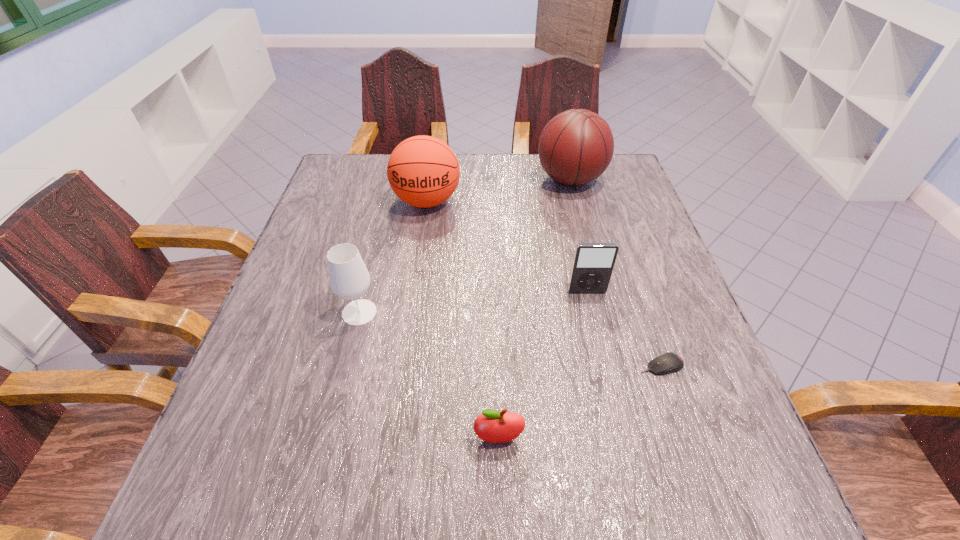
At what (x,y) coordinates should I click in order to perform the action: click on vacant space at the near edge. Please return your answer as a coordinate pair (x, y). The image size is (960, 540). Looking at the image, I should click on (591, 487).

Find the location of a particular element. The width and height of the screenshot is (960, 540). blank area at the right edge is located at coordinates (658, 256).

In the image, there is a desktop. Identify the location of free space at the far left corner. (364, 180).

Locate an element on the screen. The image size is (960, 540). free space at the far right corner is located at coordinates (617, 193).

Where is `free space between the left basketball and the right basketball`? This screenshot has width=960, height=540. free space between the left basketball and the right basketball is located at coordinates (498, 191).

I want to click on free spot between the fourth object from right to left and the glass, so click(x=429, y=375).

The width and height of the screenshot is (960, 540). I want to click on vacant area that lies between the fourth farthest object and the right basketball, so click(x=465, y=246).

You are a GUI agent. You are given a task and a screenshot of the screen. Output one action in this format:
    pyautogui.click(x=<x>, y=<y>)
    Task: Click on the empty space between the glass and the left basketball
    Image resolution: width=960 pixels, height=540 pixels.
    Given the screenshot: What is the action you would take?
    pyautogui.click(x=393, y=257)

The height and width of the screenshot is (540, 960). Identify the location of free space between the fourth tallest object and the computer mouse. (624, 329).

The height and width of the screenshot is (540, 960). I want to click on free space between the right basketball and the computer mouse, so click(615, 273).